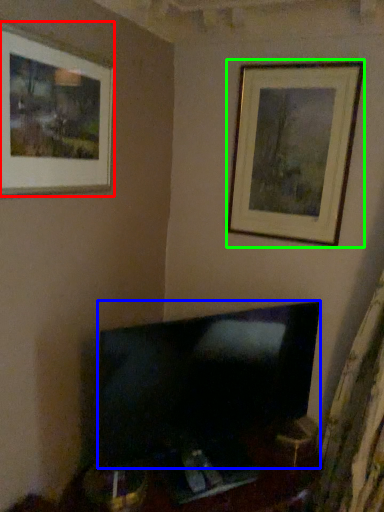
Question: Which object is positioned closest to picture frame (highlighted by a red box)? Select from television (highlighted by a blue box) and picture frame (highlighted by a green box).

Choices:
 (A) television
 (B) picture frame

Answer: (B)